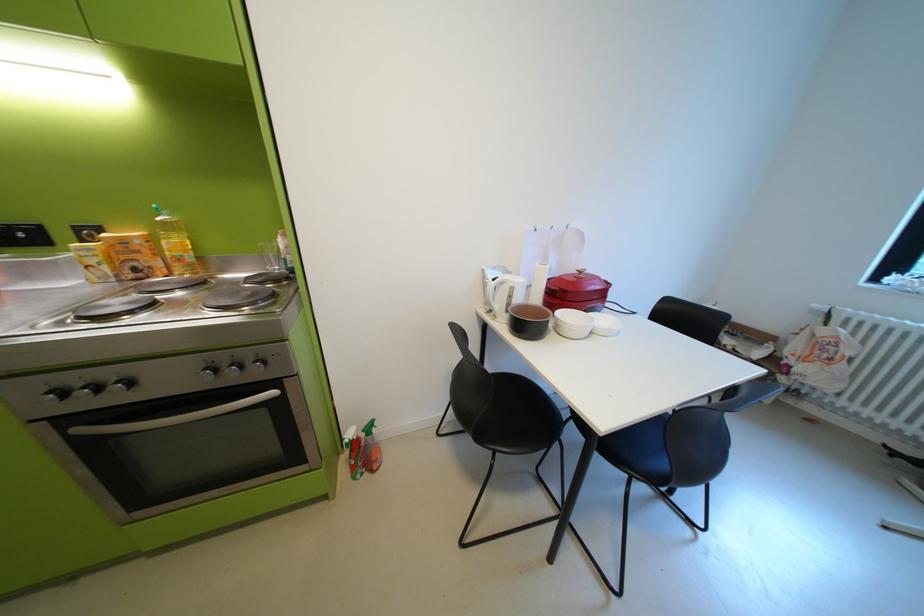
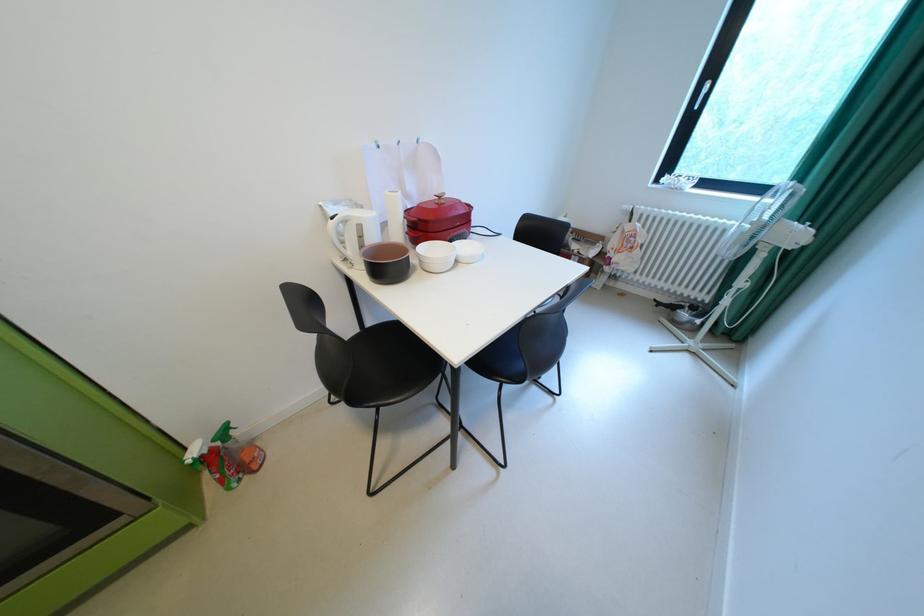
Where in the second image is the point corresponding to the point at 373,432 from the first image?

(224, 442)